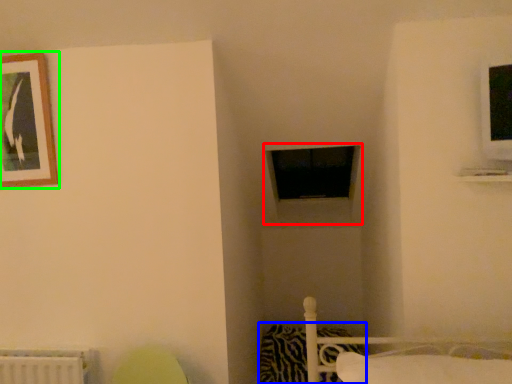
Question: Estimate the real-world distances between objects in this image. Which object is farther from window frame (highlighted by a red box), pillow (highlighted by a blue box) or picture frame (highlighted by a green box)?

Choices:
 (A) pillow
 (B) picture frame

Answer: (B)